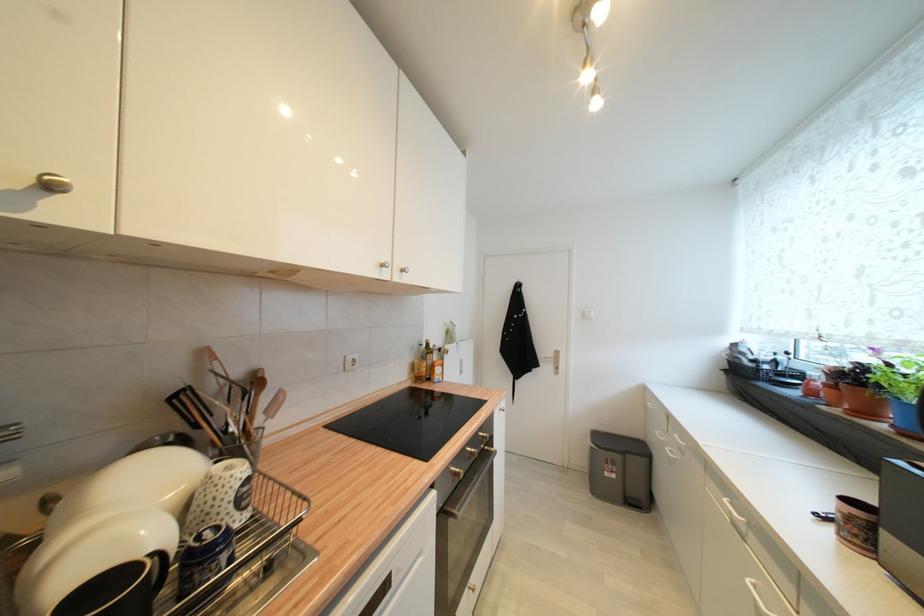
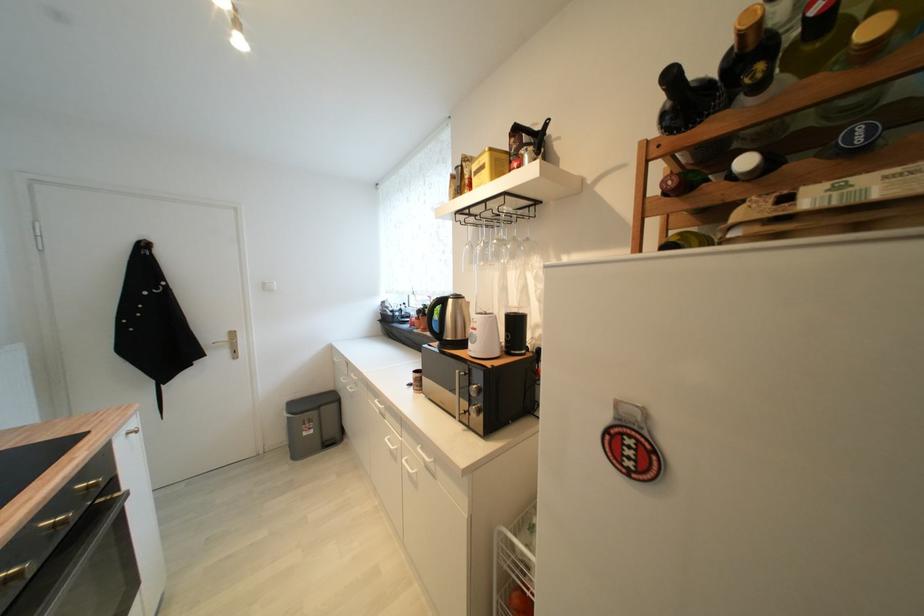
Where in the second image is the point corresponding to the point at 869,370 from the first image?

(431, 309)